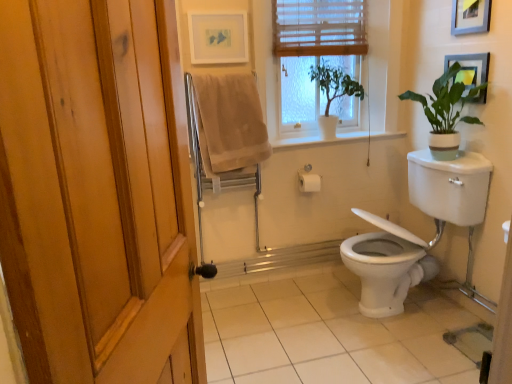
Question: Considering the relative sizes of green matte plant at upper center, the second houseplant from the right, and white glossy toilet at lower right in the image provided, is green matte plant at upper center, the second houseplant from the right, shorter than white glossy toilet at lower right?

Choices:
 (A) yes
 (B) no

Answer: (A)

Question: Is green matte plant at upper center, the second houseplant from the right, positioned far away from white glossy toilet at lower right?

Choices:
 (A) no
 (B) yes

Answer: (A)

Question: Is green matte plant at upper center, the second houseplant from the right, taller than white glossy toilet at lower right?

Choices:
 (A) no
 (B) yes

Answer: (A)

Question: Can you confirm if green matte plant at upper center, acting as the 1th houseplant starting from the left, is bigger than white glossy toilet at lower right?

Choices:
 (A) yes
 (B) no

Answer: (B)

Question: From a real-world perspective, is green matte plant at upper center, acting as the 1th houseplant starting from the left, located beneath white glossy toilet at lower right?

Choices:
 (A) no
 (B) yes

Answer: (A)

Question: Is green matte plant at upper center, the second houseplant from the right, positioned in front of white glossy toilet at lower right?

Choices:
 (A) no
 (B) yes

Answer: (A)

Question: From a real-world perspective, is white tile at lower center located higher than green matte plant at upper right, which appears as the 1th houseplant when viewed from the right?

Choices:
 (A) no
 (B) yes

Answer: (A)

Question: Does white tile at lower center have a greater width compared to green matte plant at upper right, the second houseplant when ordered from left to right?

Choices:
 (A) yes
 (B) no

Answer: (A)

Question: Would you say white tile at lower center is outside green matte plant at upper right, the second houseplant when ordered from left to right?

Choices:
 (A) yes
 (B) no

Answer: (A)

Question: Is white tile at lower center to the left of green matte plant at upper right, the second houseplant when ordered from left to right, from the viewer's perspective?

Choices:
 (A) yes
 (B) no

Answer: (A)

Question: Considering the relative positions of white tile at lower center and green matte plant at upper right, which appears as the 1th houseplant when viewed from the right, in the image provided, is white tile at lower center to the right of green matte plant at upper right, which appears as the 1th houseplant when viewed from the right, from the viewer's perspective?

Choices:
 (A) no
 (B) yes

Answer: (A)

Question: Could green matte plant at upper right, the second houseplant when ordered from left to right, be considered to be inside white tile at lower center?

Choices:
 (A) yes
 (B) no

Answer: (B)

Question: From a real-world perspective, is matte white picture frame at upper center, which is the first picture frame from left to right, beneath wooden blinds at upper center?

Choices:
 (A) no
 (B) yes

Answer: (A)